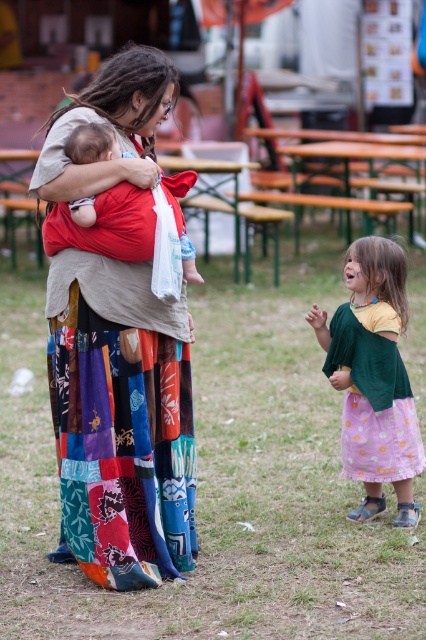
You are standing in the center of the scene and see the point at coordinates (120,419). What object is located at that point?

The point at coordinates (120,419) indicates the multicolored patchwork skirt at center.